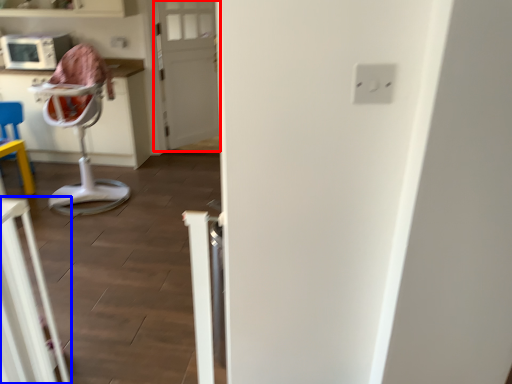
Question: Which object appears closest to the camera in this image, door (highlighted by a red box) or furniture (highlighted by a blue box)?

Choices:
 (A) door
 (B) furniture

Answer: (B)